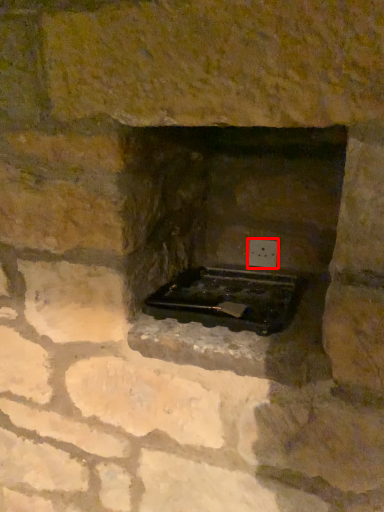
Question: Observing the image, what is the correct spatial positioning of electric outlet (annotated by the red box) in reference to appliance?

Choices:
 (A) left
 (B) right

Answer: (B)